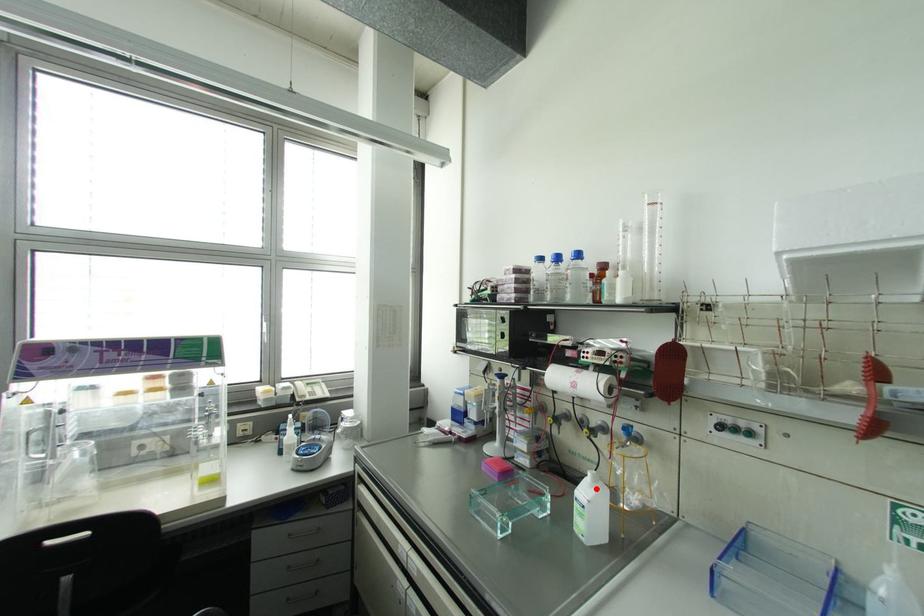
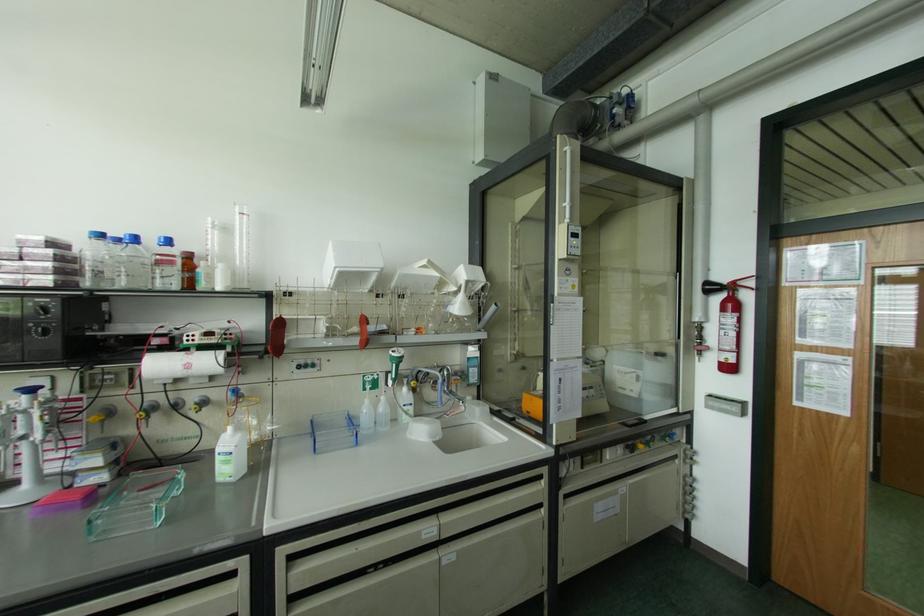
Question: I am providing you with two images of the same scene from different viewpoints. Image1 has a red point marked. In image2, the corresponding 3D location appears at what relative position? Reply with the corresponding letter.

Choices:
 (A) Closer
 (B) Farther

Answer: (B)